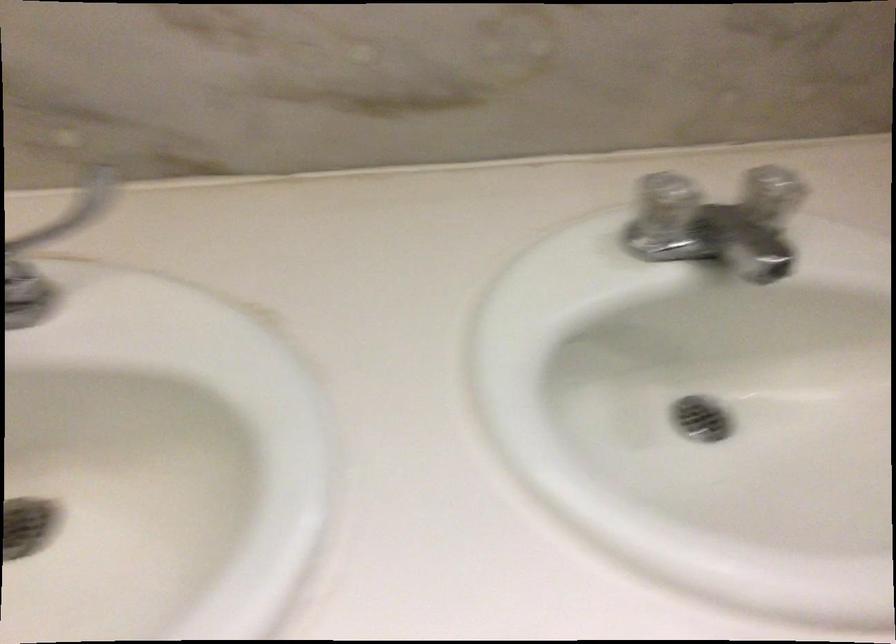
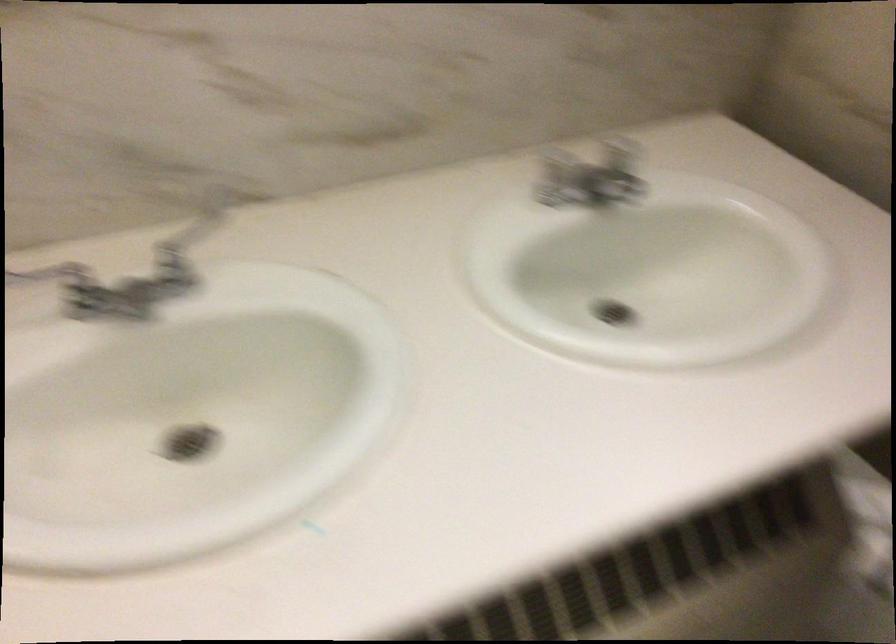
Find the pixel in the second image that matches (x=661, y=192) in the first image.

(554, 158)